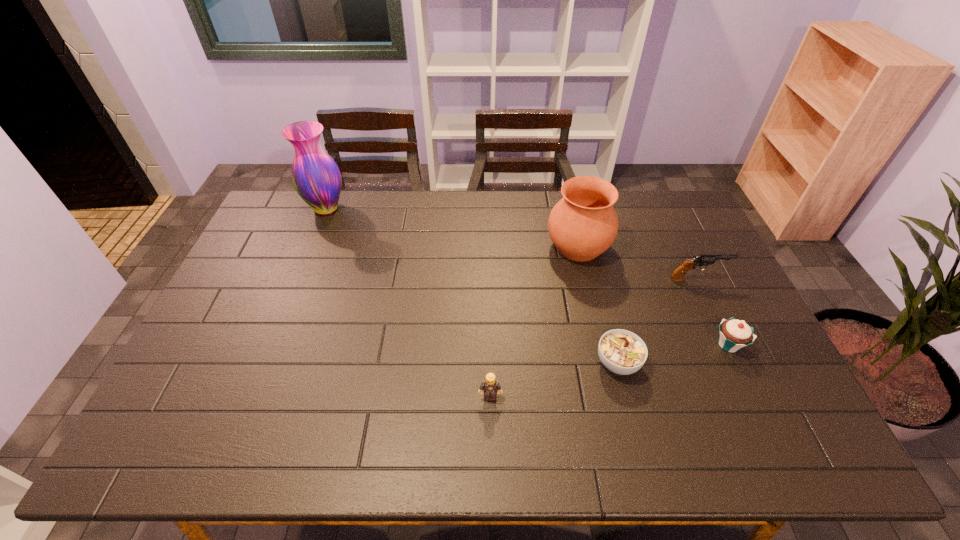
This screenshot has height=540, width=960. I want to click on vase, so click(316, 177).

Identify the location of the leftmost object. Image resolution: width=960 pixels, height=540 pixels. (316, 177).

You are a GUI agent. You are given a task and a screenshot of the screen. Output one action in this format:
    pyautogui.click(x=<x>, y=<y>)
    Task: Click on the pottery
    The height and width of the screenshot is (540, 960).
    Given the screenshot: What is the action you would take?
    pyautogui.click(x=583, y=224)

Image resolution: width=960 pixels, height=540 pixels. I want to click on the second farthest object, so click(x=583, y=224).

This screenshot has height=540, width=960. I want to click on gun, so click(x=704, y=259).

At what (x,y) coordinates should I click in order to perform the action: click on the second object from left to right. Please return your answer as a coordinate pair (x, y). Looking at the image, I should click on (490, 386).

Where is `Lego`? Lego is located at coordinates (490, 386).

Identify the location of cupcake. The height and width of the screenshot is (540, 960). (734, 334).

Identify the location of soup bowl. (622, 352).

This screenshot has height=540, width=960. Find the location of `vacant space situated on the right of the leftmost object`. vacant space situated on the right of the leftmost object is located at coordinates (456, 208).